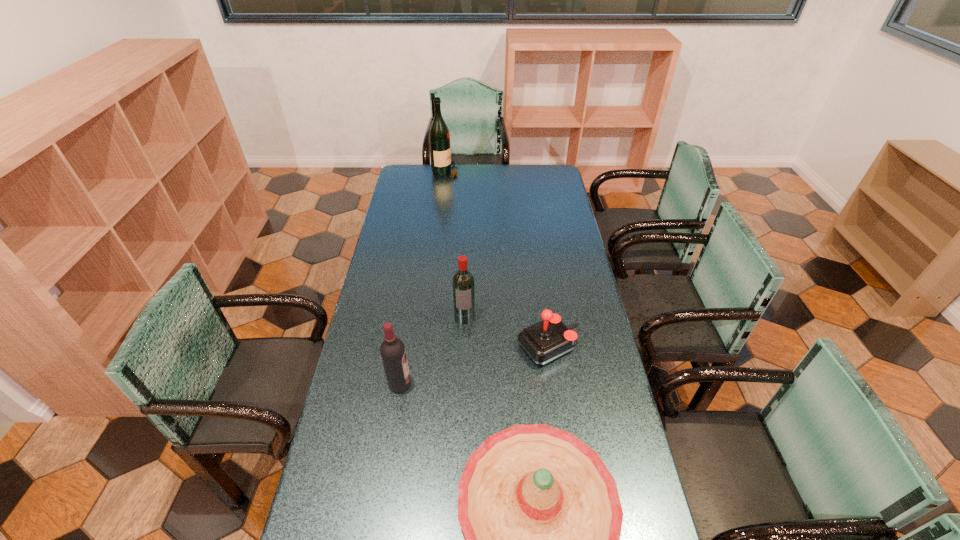
Identify the location of object located at the far edge. (439, 137).

Locate an element on the screen. Image resolution: width=960 pixels, height=540 pixels. object situated at the left edge is located at coordinates (392, 350).

You are a GUI agent. You are given a task and a screenshot of the screen. Output one action in this format:
    pyautogui.click(x=<x>, y=<y>)
    Task: Click on the object at the right edge
    
    Given the screenshot: What is the action you would take?
    pyautogui.click(x=548, y=339)

In the image, there is a desktop. Identify the location of vacant space at the far edge. This screenshot has height=540, width=960. (459, 168).

The height and width of the screenshot is (540, 960). In the image, there is a desktop. Identify the location of vacant space at the left edge. (388, 239).

Find the location of a particular element. vacant space at the right edge of the desktop is located at coordinates (574, 240).

Where is `blank space at the far left corner of the desktop`? This screenshot has width=960, height=540. blank space at the far left corner of the desktop is located at coordinates (407, 168).

What are the coordinates of `unoccupied area between the second nearest object and the tallest object` in the screenshot? It's located at (423, 278).

The image size is (960, 540). What are the coordinates of `vacant space in between the second nearest object and the joystick` in the screenshot? It's located at (474, 365).

Identify the location of free area in between the nearest wine bottle and the tallest wine bottle. (423, 278).